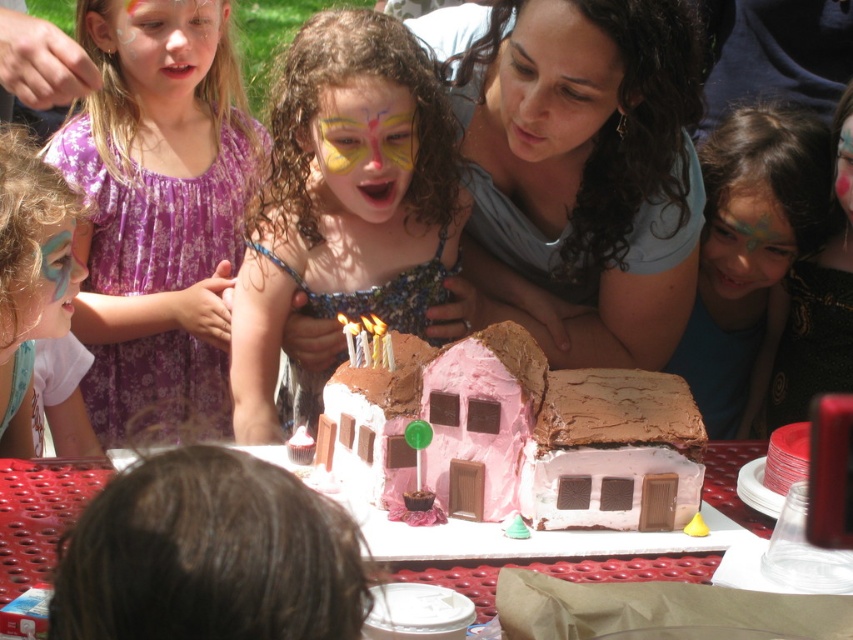
Question: Is matte gray shirt at center further to camera compared to matte brown cake at center?

Choices:
 (A) yes
 (B) no

Answer: (B)

Question: Which point is farther to the camera?

Choices:
 (A) (283, 308)
 (B) (491, 422)
 (C) (343, 122)
 (D) (113, 17)

Answer: (D)

Question: Can you confirm if matte blue face paint at lower left is bigger than pastel blue face paint at lower left?

Choices:
 (A) yes
 (B) no

Answer: (A)

Question: Which of the following is the farthest from the observer?

Choices:
 (A) smooth skin face at center
 (B) smooth plastic table at center

Answer: (A)

Question: Which point is closer to the camera taking this photo?

Choices:
 (A) (71, 218)
 (B) (712, 390)
 (C) (393, 209)
 (D) (167, 17)

Answer: (A)

Question: Is matte brown cake at center thinner than pastel blue face paint at center?

Choices:
 (A) no
 (B) yes

Answer: (A)